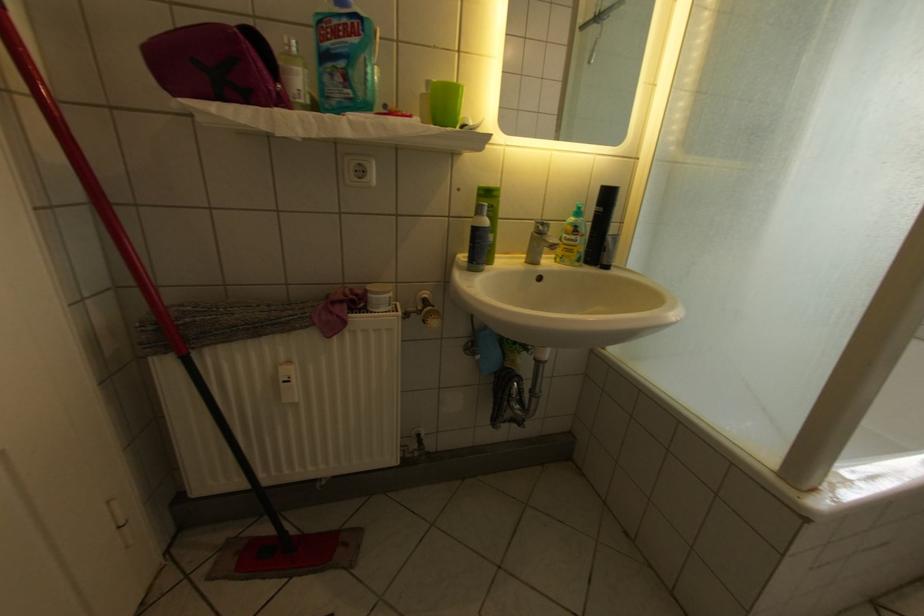
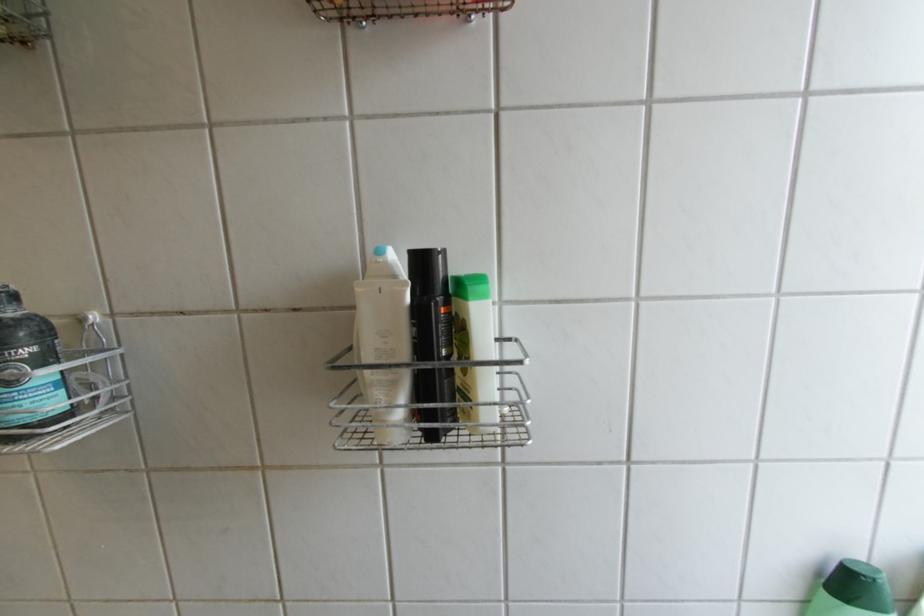
What movement of the cameraman would produce the second image?

The cameraman walked toward right, forward.